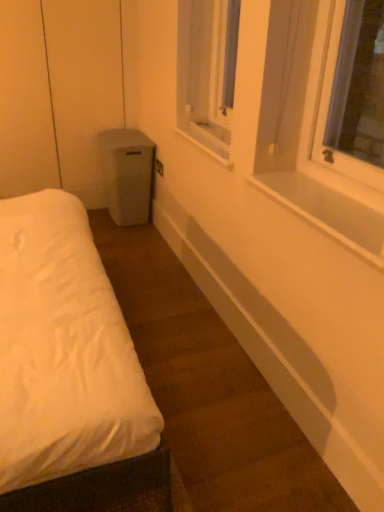
Question: From a real-world perspective, does clear plastic window screen at upper center stand above white smooth window sill at upper right, positioned as the second window sill in back-to-front order?

Choices:
 (A) no
 (B) yes

Answer: (B)

Question: Is clear plastic window screen at upper center turned away from white smooth window sill at upper right, positioned as the second window sill in back-to-front order?

Choices:
 (A) no
 (B) yes

Answer: (A)

Question: Can you confirm if clear plastic window screen at upper center is thinner than white smooth window sill at upper right, positioned as the second window sill in back-to-front order?

Choices:
 (A) yes
 (B) no

Answer: (A)

Question: From a real-world perspective, is clear plastic window screen at upper center under white smooth window sill at upper right, positioned as the second window sill in back-to-front order?

Choices:
 (A) yes
 (B) no

Answer: (B)

Question: Is clear plastic window screen at upper center aimed at white smooth window sill at upper right, which is the second window sill from top to bottom?

Choices:
 (A) yes
 (B) no

Answer: (B)

Question: Based on their positions, is white smooth window sill at upper right, positioned as the second window sill in back-to-front order, located to the left or right of white plastic window sill at center, which ranks as the second window sill in front-to-back order?

Choices:
 (A) right
 (B) left

Answer: (A)

Question: From a real-world perspective, relative to white plastic window sill at center, arranged as the first window sill when viewed from the top, is white smooth window sill at upper right, which is counted as the first window sill, starting from the front, vertically above or below?

Choices:
 (A) above
 (B) below

Answer: (B)

Question: Is white smooth window sill at upper right, positioned as the 1th window sill in bottom-to-top order, taller or shorter than white plastic window sill at center, placed as the 1th window sill when sorted from back to front?

Choices:
 (A) tall
 (B) short

Answer: (B)

Question: Is white smooth window sill at upper right, positioned as the second window sill in back-to-front order, bigger or smaller than white plastic window sill at center, arranged as the first window sill when viewed from the top?

Choices:
 (A) small
 (B) big

Answer: (A)

Question: Is point (231, 108) positioned closer to the camera than point (349, 238)?

Choices:
 (A) farther
 (B) closer

Answer: (A)

Question: In the image, is clear plastic window screen at upper center on the left side or the right side of white smooth window sill at upper right, positioned as the second window sill in back-to-front order?

Choices:
 (A) left
 (B) right

Answer: (A)

Question: Do you think clear plastic window screen at upper center is within white smooth window sill at upper right, positioned as the second window sill in back-to-front order, or outside of it?

Choices:
 (A) outside
 (B) inside

Answer: (A)

Question: Considering their positions, is clear plastic window screen at upper center located in front of or behind white smooth window sill at upper right, which is counted as the first window sill, starting from the front?

Choices:
 (A) front
 (B) behind

Answer: (B)

Question: Is white plastic window sill at center, arranged as the first window sill when viewed from the top, taller or shorter than clear plastic window screen at upper center?

Choices:
 (A) tall
 (B) short

Answer: (B)

Question: Considering the positions of point (218, 156) and point (225, 61), is point (218, 156) closer or farther from the camera than point (225, 61)?

Choices:
 (A) farther
 (B) closer

Answer: (B)